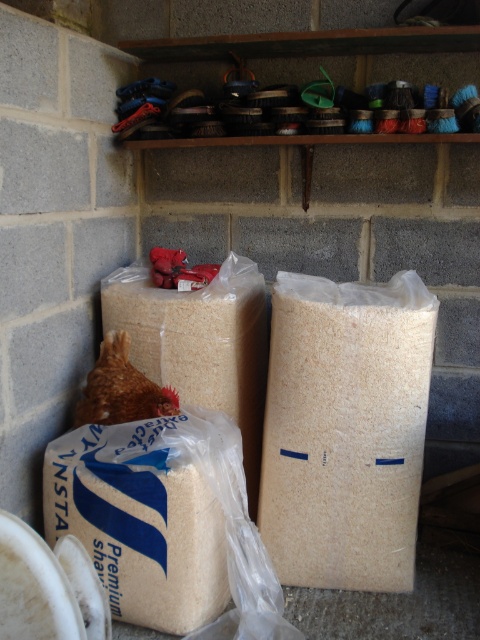
Question: Is white matte paper bag at center wider than brown feathered chicken at lower left?

Choices:
 (A) yes
 (B) no

Answer: (A)

Question: Which object appears farthest from the camera in this image?

Choices:
 (A) white matte paper bag at center
 (B) brown feathered chicken at lower left

Answer: (B)

Question: Is white matte paper bag at center wider than brown feathered chicken at lower left?

Choices:
 (A) yes
 (B) no

Answer: (A)

Question: Which of the following is the closest to the observer?

Choices:
 (A) (326, 408)
 (B) (135, 403)

Answer: (A)

Question: Does white matte paper bag at center have a smaller size compared to brown feathered chicken at lower left?

Choices:
 (A) no
 (B) yes

Answer: (A)